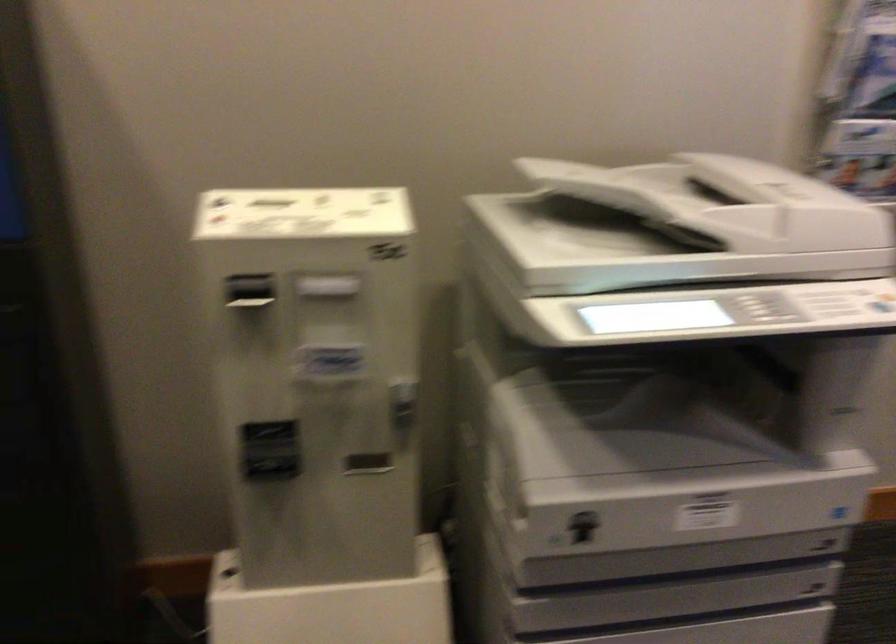
What do you see at coordinates (582, 526) in the screenshot? I see `the printer tray handle` at bounding box center [582, 526].